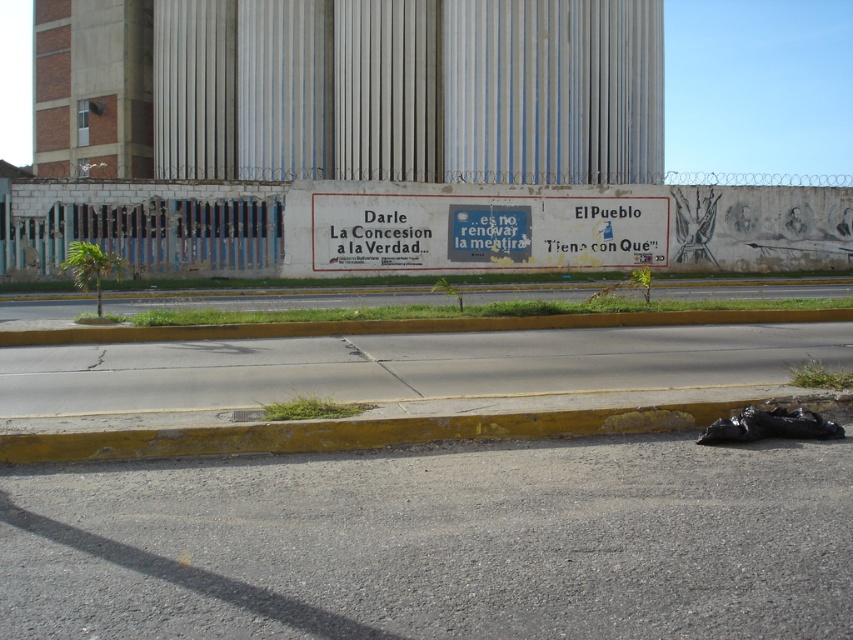
Question: Is yellow painted curb at lower center positioned in front of yellow concrete curb at lower center?

Choices:
 (A) no
 (B) yes

Answer: (B)

Question: Among these objects, which one is farthest from the camera?

Choices:
 (A) yellow concrete curb at lower center
 (B) gray asphalt at lower center
 (C) yellow painted curb at lower center

Answer: (A)

Question: Which object appears closest to the camera in this image?

Choices:
 (A) yellow concrete curb at lower center
 (B) gray asphalt at lower center
 (C) yellow painted curb at lower center

Answer: (B)

Question: Which point is closer to the camera taking this photo?

Choices:
 (A) (639, 602)
 (B) (534, 320)

Answer: (A)

Question: Considering the relative positions of gray asphalt at lower center and yellow concrete curb at lower center in the image provided, where is gray asphalt at lower center located with respect to yellow concrete curb at lower center?

Choices:
 (A) right
 (B) left

Answer: (B)

Question: Does gray asphalt at lower center have a smaller size compared to yellow painted curb at lower center?

Choices:
 (A) yes
 (B) no

Answer: (B)